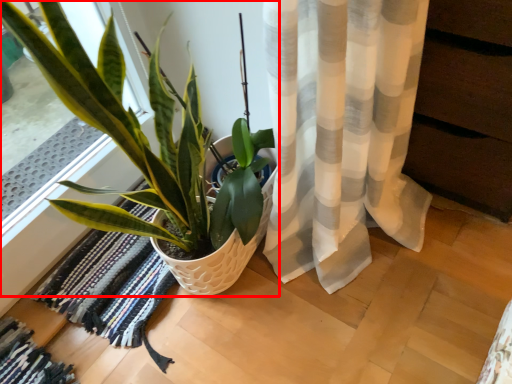
Question: From the image's perspective, where is houseplant (annotated by the red box) located in relation to mat in the image?

Choices:
 (A) below
 (B) above

Answer: (B)